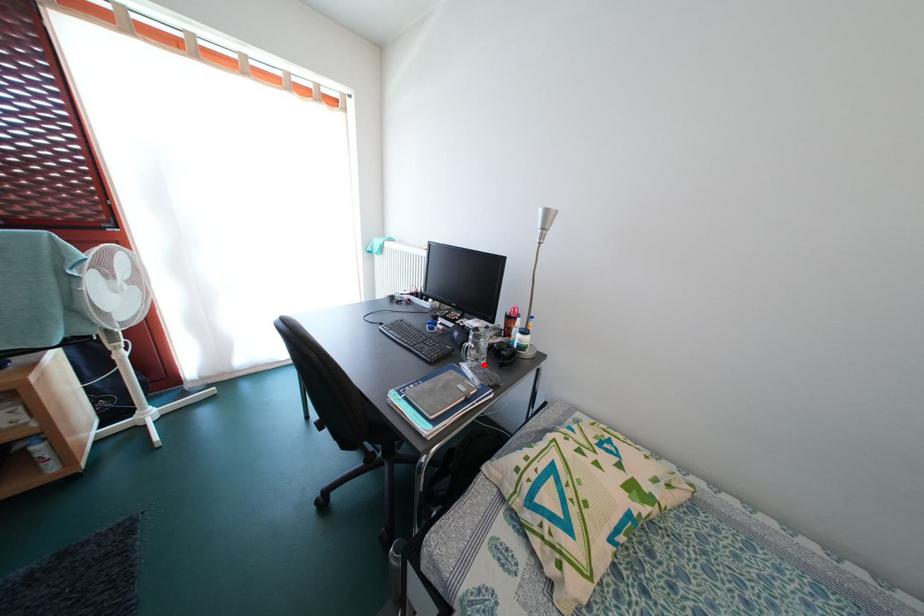
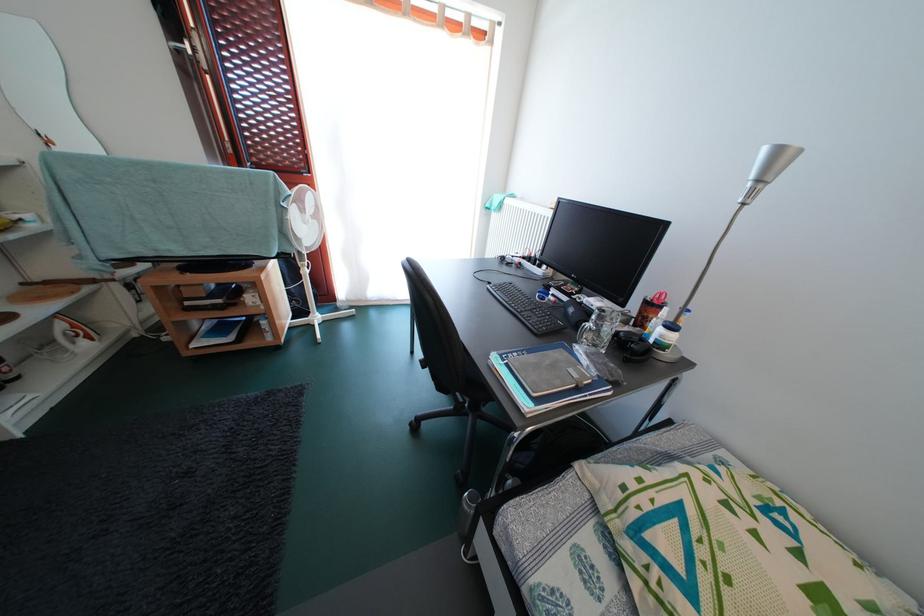
The point at the highlighted location is marked in the first image. Where is the corresponding point in the second image?

(602, 351)